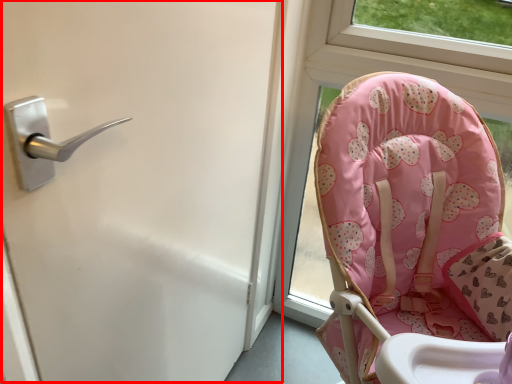
Question: Where is screen door (annotated by the red box) located in relation to chair in the image?

Choices:
 (A) right
 (B) left

Answer: (B)